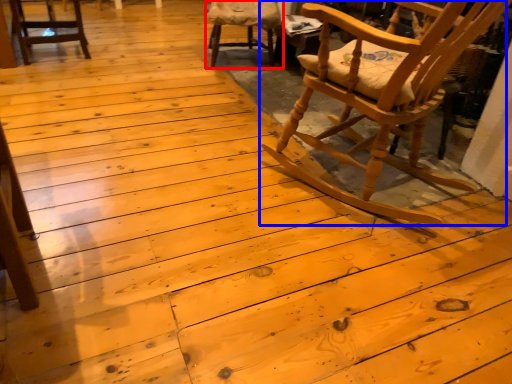
Question: Which object is further to the camera taking this photo, chair (highlighted by a red box) or chair (highlighted by a blue box)?

Choices:
 (A) chair
 (B) chair

Answer: (A)